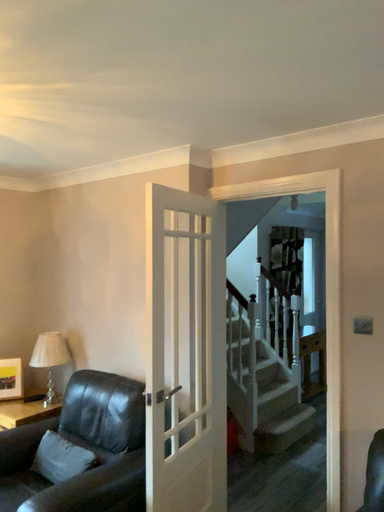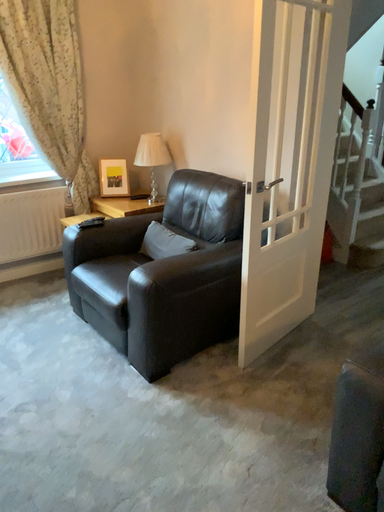
Question: Which way did the camera rotate in the video?

Choices:
 (A) rotated upward
 (B) rotated downward

Answer: (B)